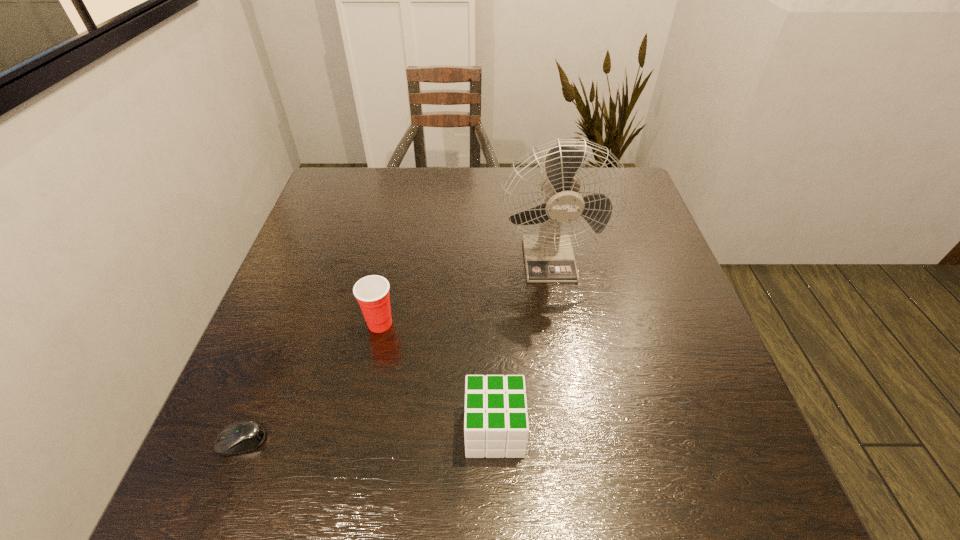
At what (x,y) coordinates should I click in order to perform the action: click on fan. Please return your answer as a coordinate pair (x, y). This screenshot has height=540, width=960. Looking at the image, I should click on (549, 257).

Identify the location of the tallest object. (549, 257).

Locate an element on the screen. Dixie cup is located at coordinates (372, 292).

Locate an element on the screen. the second object from left to right is located at coordinates (372, 292).

At what (x,y) coordinates should I click in order to perform the action: click on cube. Please return your answer as a coordinate pair (x, y). This screenshot has width=960, height=540. Looking at the image, I should click on (496, 425).

You are a GUI agent. You are given a task and a screenshot of the screen. Output one action in this format:
    pyautogui.click(x=<x>, y=<y>)
    Task: Click on the mouse
    This screenshot has width=960, height=540.
    Given the screenshot: What is the action you would take?
    pyautogui.click(x=239, y=437)

Where is `the leftmost object`? The height and width of the screenshot is (540, 960). the leftmost object is located at coordinates (239, 437).

At what (x,y) coordinates should I click in order to perform the action: click on vacant space located on the air flow direction of the fan. Please return your answer as a coordinate pair (x, y). Looking at the image, I should click on (561, 335).

You are a GUI agent. You are given a task and a screenshot of the screen. Output one action in this format:
    pyautogui.click(x=<x>, y=<y>)
    Task: Click on the free space located on the right of the second object from left to right
    The width and height of the screenshot is (960, 540).
    Given the screenshot: What is the action you would take?
    pyautogui.click(x=473, y=323)

At what (x,y) coordinates should I click in order to perform the action: click on vacant region located 0.340m on the red face of the cube. Please return your answer as a coordinate pair (x, y). The image size is (960, 540). Looking at the image, I should click on (278, 430).